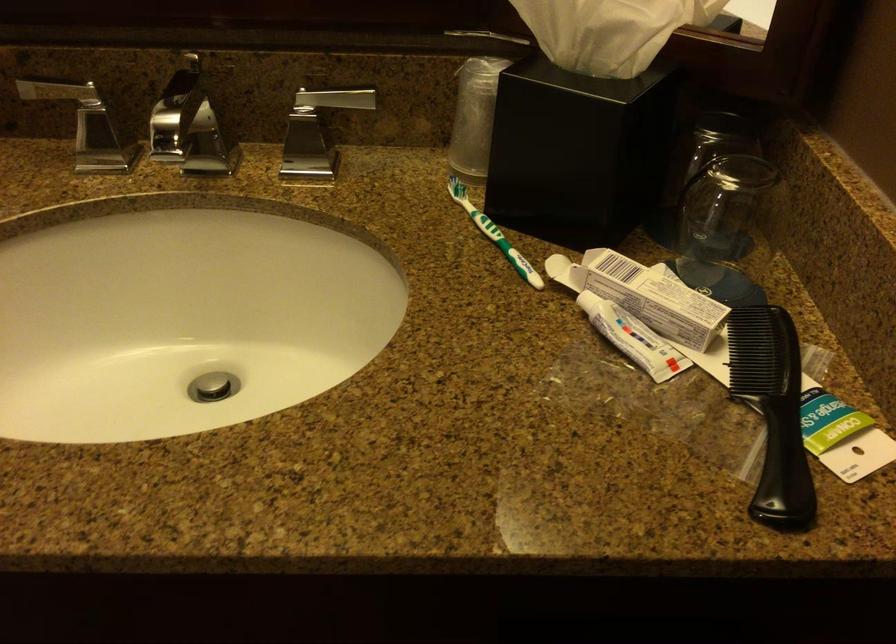
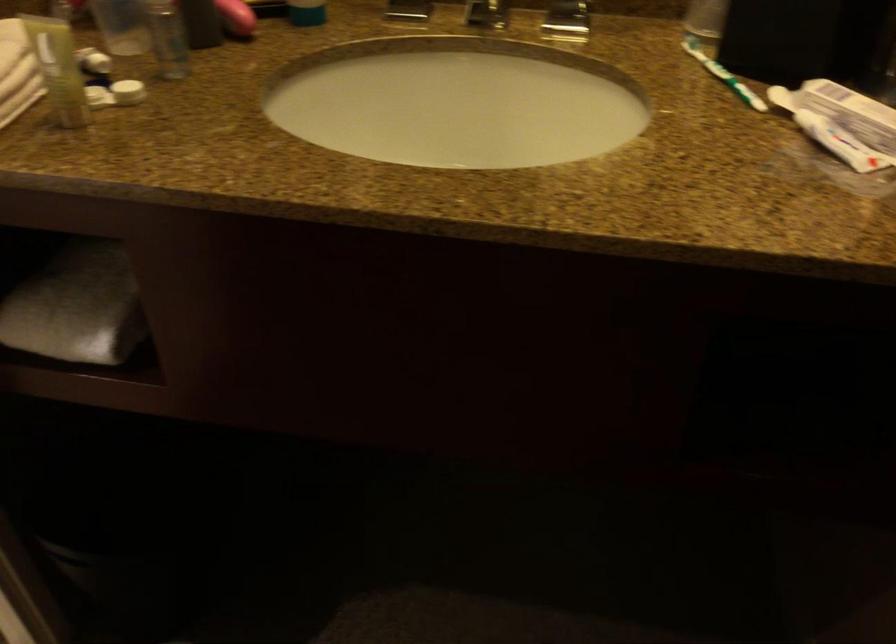
Where in the second image is the point corresponding to (492,232) from the first image?

(722, 75)